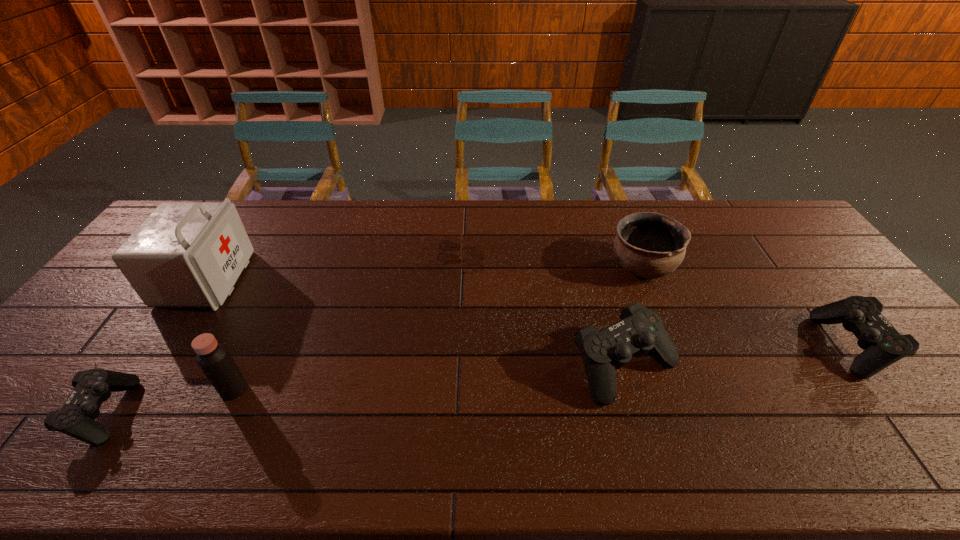
Where is `vacant point that satisfies the following two spatial constraints: 1. on the front-facing side of the tallest object; 2. on the left side of the fourth shortest object`? vacant point that satisfies the following two spatial constraints: 1. on the front-facing side of the tallest object; 2. on the left side of the fourth shortest object is located at coordinates tap(148, 366).

Find the location of a particular element. The image size is (960, 540). vacant area that satisfies the following two spatial constraints: 1. on the front-facing side of the fourth object from left to right; 2. on the left side of the pottery is located at coordinates (441, 267).

The height and width of the screenshot is (540, 960). What are the coordinates of `free location that satisfies the following two spatial constraints: 1. on the front-facing side of the fourth tallest object; 2. on the right side of the first-aid kit` in the screenshot? It's located at (148, 366).